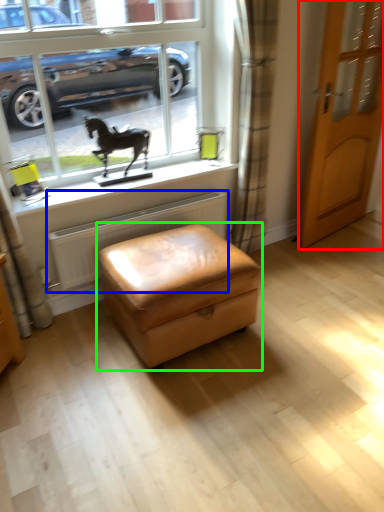
Question: Estimate the real-world distances between objects in this image. Which object is farther from door (highlighted by a red box), radiator (highlighted by a blue box) or stool (highlighted by a green box)?

Choices:
 (A) radiator
 (B) stool

Answer: (B)